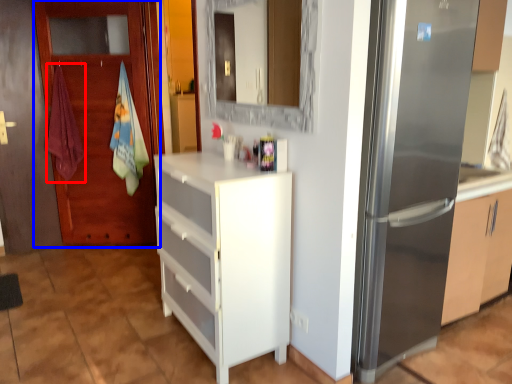
Question: Which of the following is the closest to the observer, beach towel (highlighted by a red box) or door (highlighted by a blue box)?

Choices:
 (A) beach towel
 (B) door

Answer: (B)